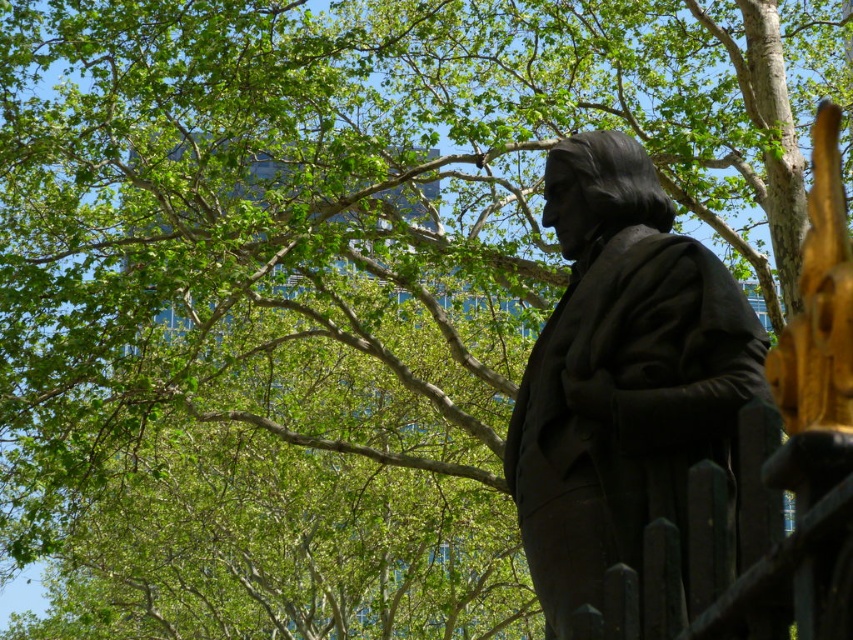
You are a painter standing at the base of the black metal fence at lower right, wanting to paint the black polished statue at center. Considering their heights, will you need to tilt your head upwards to see the entire statue?

The black polished statue at center is taller than the black metal fence at lower right, so yes, you will need to tilt your head upwards to see the entire statue.

You are a photographer trying to capture a clear shot of the black polished statue at center without any obstructions. However, you notice the black metal fence at lower right might be in the way. Based on their positions, can you determine if the fence will block your view of the statue?

The black metal fence at lower right is behind the black polished statue at center, so it will not block your view of the statue.